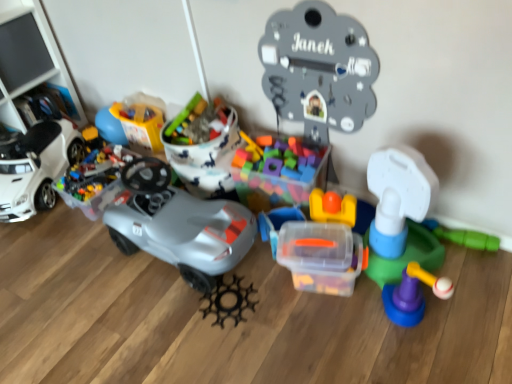
Question: Is matte gray car at center, acting as the sixth toy starting from the right, taller or shorter than translucent plastic container at center, which is counted as the 4th toy, starting from the right?

Choices:
 (A) short
 (B) tall

Answer: (B)

Question: Looking at their shapes, would you say matte gray car at center, acting as the sixth toy starting from the right, is wider or thinner than translucent plastic container at center, which is counted as the 4th toy, starting from the right?

Choices:
 (A) thin
 (B) wide

Answer: (B)

Question: Estimate the real-world distances between objects in this image. Which object is closer to the black plastic gear at center, placed as the 4th toy when sorted from left to right?

Choices:
 (A) metallic gray clock at upper center, the sixth toy from the left
 (B) white matte toy car at left
 (C) translucent plastic container at upper left, the 2th toy from the left
 (D) translucent plastic toy car at left, placed as the eighth toy when sorted from right to left
 (E) matte gray car at center, arranged as the 3th toy when viewed from the left

Answer: (E)

Question: Based on their relative distances, which object is farther from the metallic gray clock at upper center, the sixth toy from the left?

Choices:
 (A) translucent plastic toy car at left, placed as the eighth toy when sorted from right to left
 (B) black plastic gear at center, which is the fifth toy from right to left
 (C) transparent plastic container at center, the seventh toy when ordered from left to right
 (D) white plastic tower at right, the 8th toy when ordered from left to right
 (E) white matte toy car at left

Answer: (E)